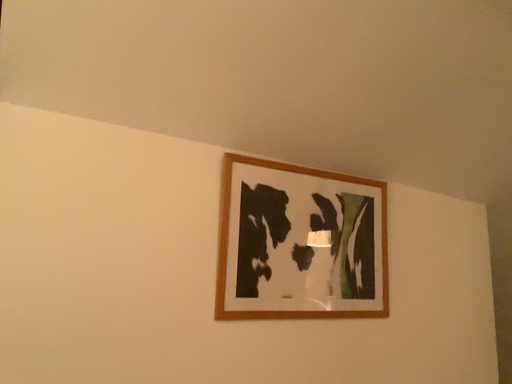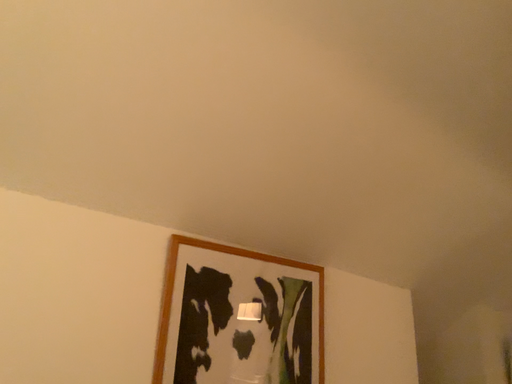
Question: How did the camera likely rotate when shooting the video?

Choices:
 (A) rotated downward
 (B) rotated upward

Answer: (B)